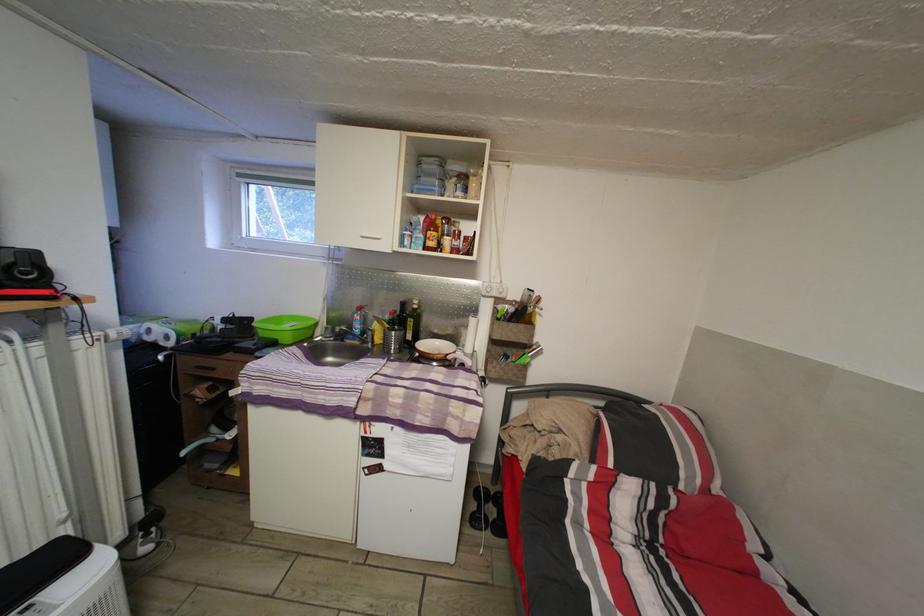
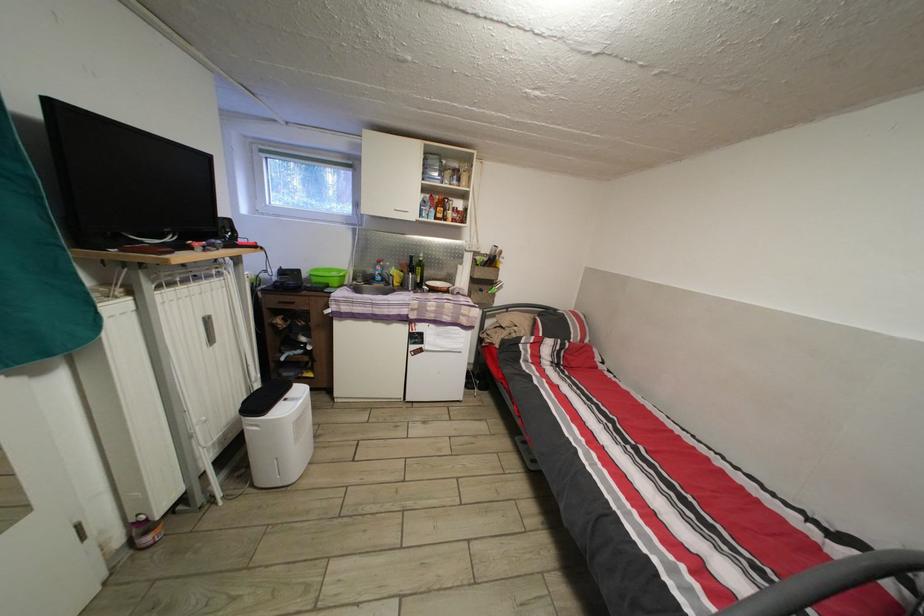
The point at (247, 182) is marked in the first image. Where is the corresponding point in the second image?

(269, 156)